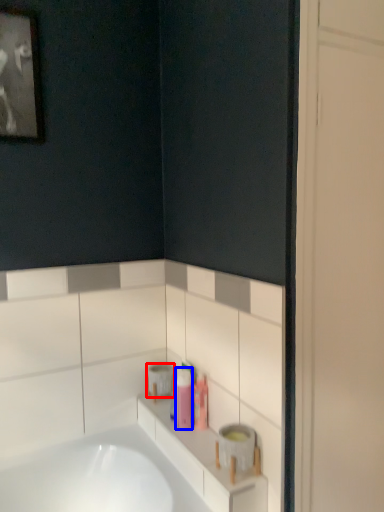
Question: Which of the following is the closest to the observer, toilet paper (highlighted by a red box) or toiletry (highlighted by a blue box)?

Choices:
 (A) toilet paper
 (B) toiletry

Answer: (B)